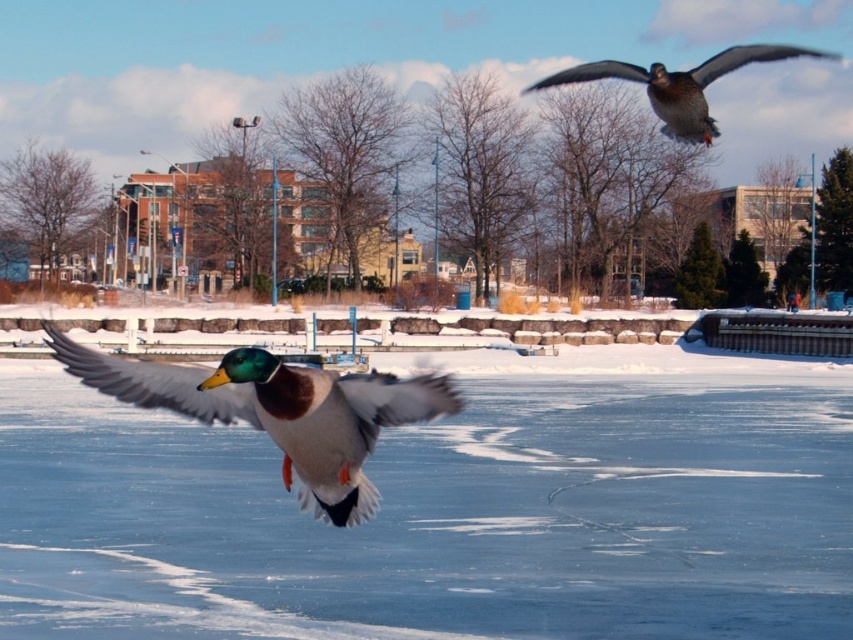
You are an ornithologist observing the ducks in flight. You notice the translucent ice at center and the shiny brown duck at upper right. Which object has a smaller width in the image?

The translucent ice at center has a lesser width compared to the shiny brown duck at upper right.

You are an observer looking at the winter scene. You notice the translucent ice at center and the shiny brown duck at upper right. Which object is located to the right of the other?

The shiny brown duck at upper right is located to the right of the translucent ice at center.

You are a photographer trying to capture the shiny brown duck at center and the translucent ice at center in the same frame. Based on their sizes, which one will appear larger in your photo?

The translucent ice at center is bigger than the shiny brown duck at center, so it will appear larger in the photo.